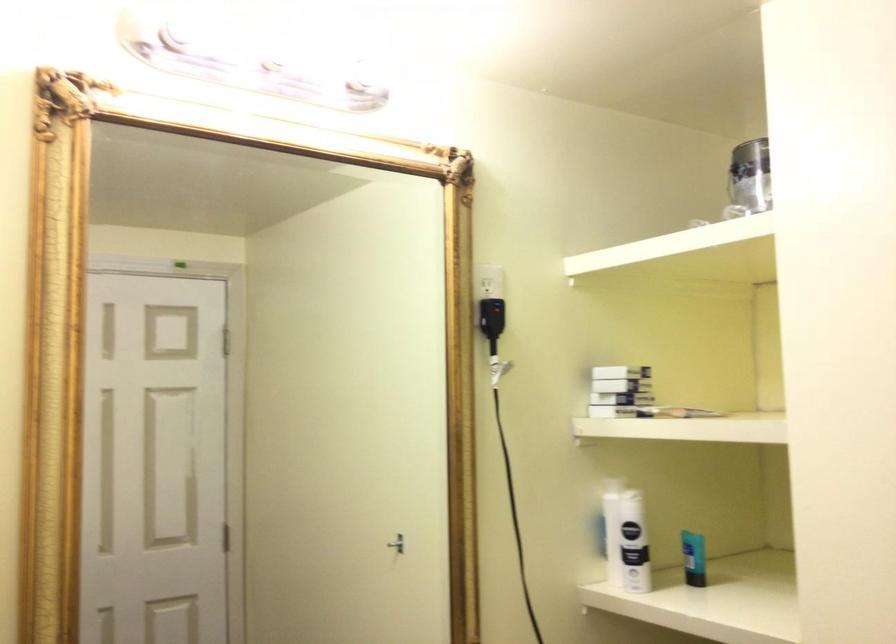
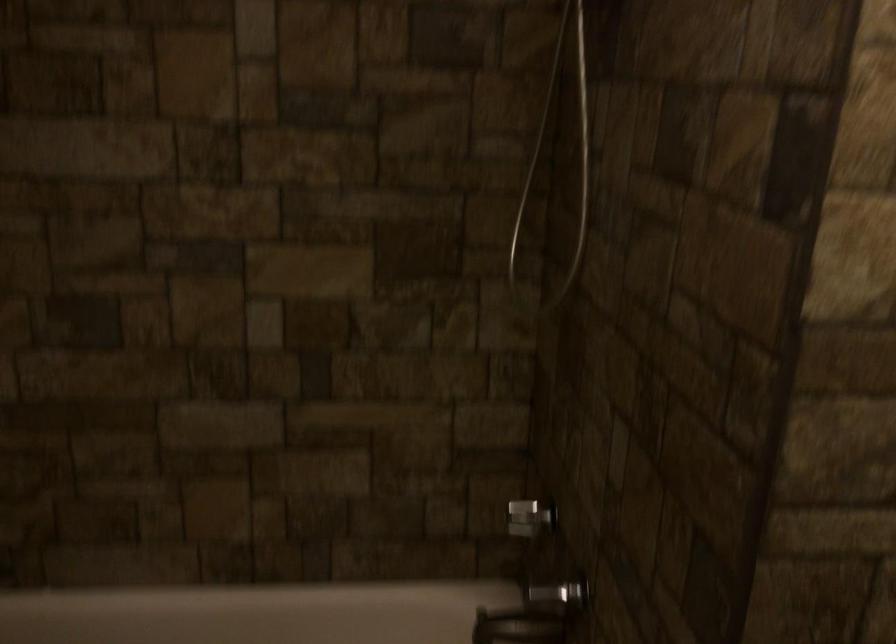
How did the camera likely rotate?

The camera's rotation is toward left-down.